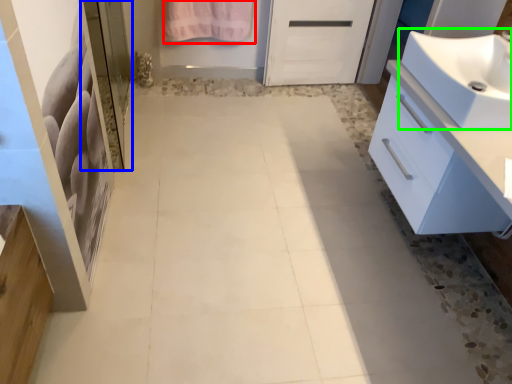
Question: Which object is positioned farthest from bath towel (highlighted by a red box)? Select from screen door (highlighted by a blue box) and sink (highlighted by a green box).

Choices:
 (A) screen door
 (B) sink

Answer: (B)